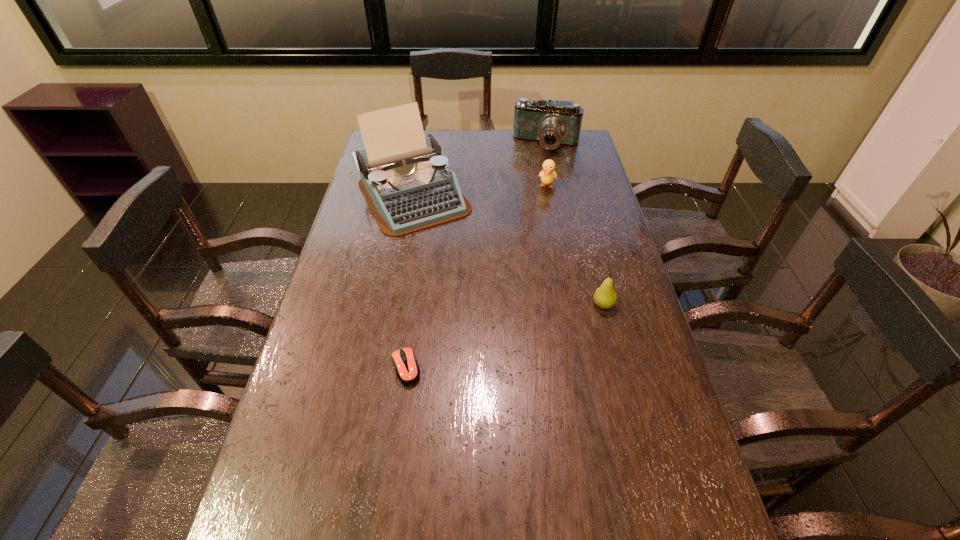
Identify the location of free space located on the front-facing side of the duckling. This screenshot has height=540, width=960. (541, 224).

The image size is (960, 540). Find the location of `free space located 0.330m on the front-facing side of the duckling`. free space located 0.330m on the front-facing side of the duckling is located at coordinates (536, 253).

This screenshot has width=960, height=540. I want to click on blank space located on the front-facing side of the second tallest object, so click(526, 202).

At what (x,y) coordinates should I click in order to perform the action: click on blank space located 0.400m on the front-facing side of the second tallest object. Please return your answer as a coordinate pair (x, y). This screenshot has width=960, height=540. Looking at the image, I should click on (521, 216).

You are a GUI agent. You are given a task and a screenshot of the screen. Output one action in this format:
    pyautogui.click(x=<x>, y=<y>)
    Task: Click on the free region located on the front-facing side of the second tallest object
    
    Given the screenshot: What is the action you would take?
    pyautogui.click(x=525, y=206)

Image resolution: width=960 pixels, height=540 pixels. Find the location of `free location located 0.210m on the typing side of the typewriter`. free location located 0.210m on the typing side of the typewriter is located at coordinates (461, 273).

Identify the location of vacant space located on the typing side of the typewriter. (457, 267).

Locate an element on the screen. The width and height of the screenshot is (960, 540). free space located on the typing side of the typewriter is located at coordinates (461, 273).

Where is `object that is at the far edge`? object that is at the far edge is located at coordinates (551, 123).

Locate an element on the screen. Image resolution: width=960 pixels, height=540 pixels. object located in the left edge section of the desktop is located at coordinates (409, 187).